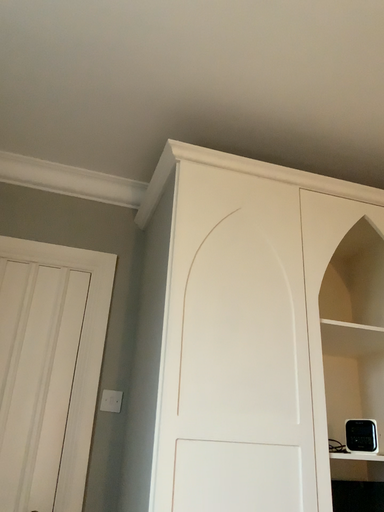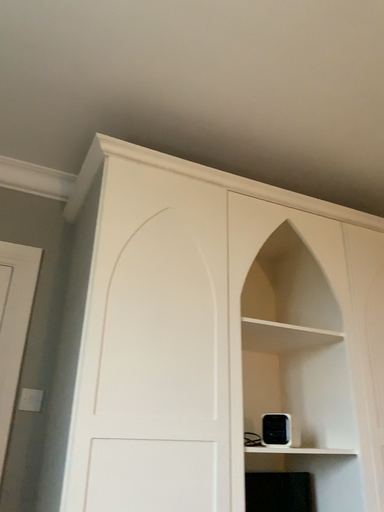
Question: How did the camera likely rotate when shooting the video?

Choices:
 (A) rotated left
 (B) rotated right

Answer: (B)